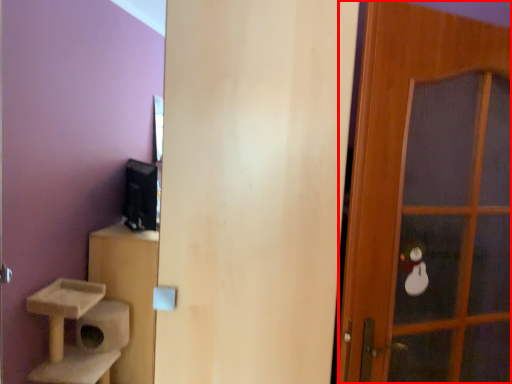
Question: Observing the image, what is the correct spatial positioning of door (annotated by the red box) in reference to door?

Choices:
 (A) right
 (B) left

Answer: (A)